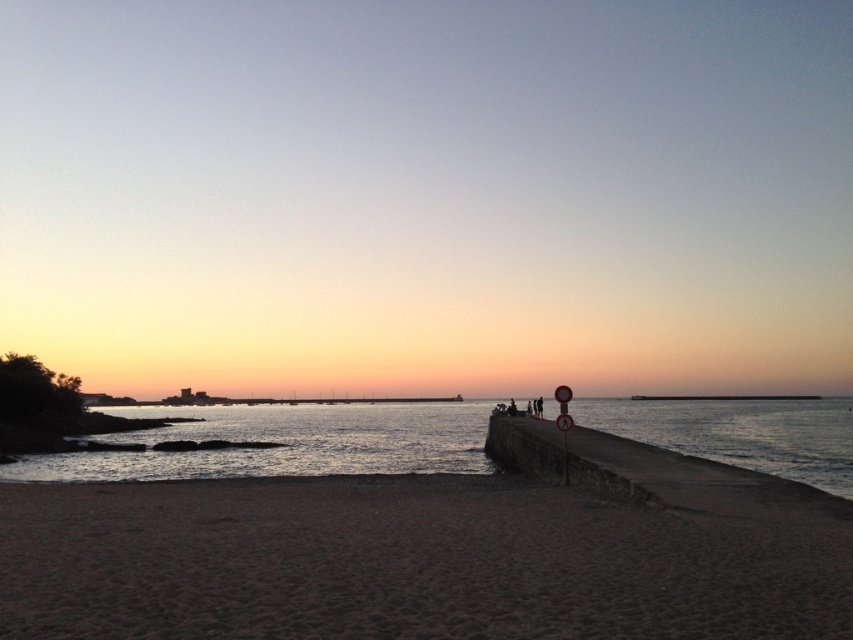
You are standing at the center of the image and want to walk to the dark brown sand at lower center. Which direction should you move?

The dark brown sand at lower center is located at coordinates point [405,563]. Since the lower center is towards the bottom middle of the image, you should move downward and slightly to the right from the center to reach it.